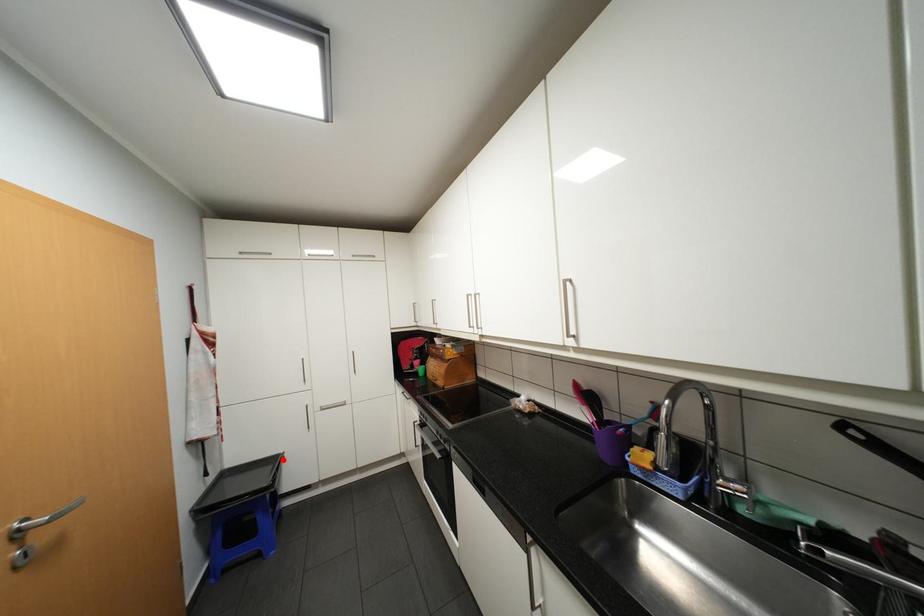
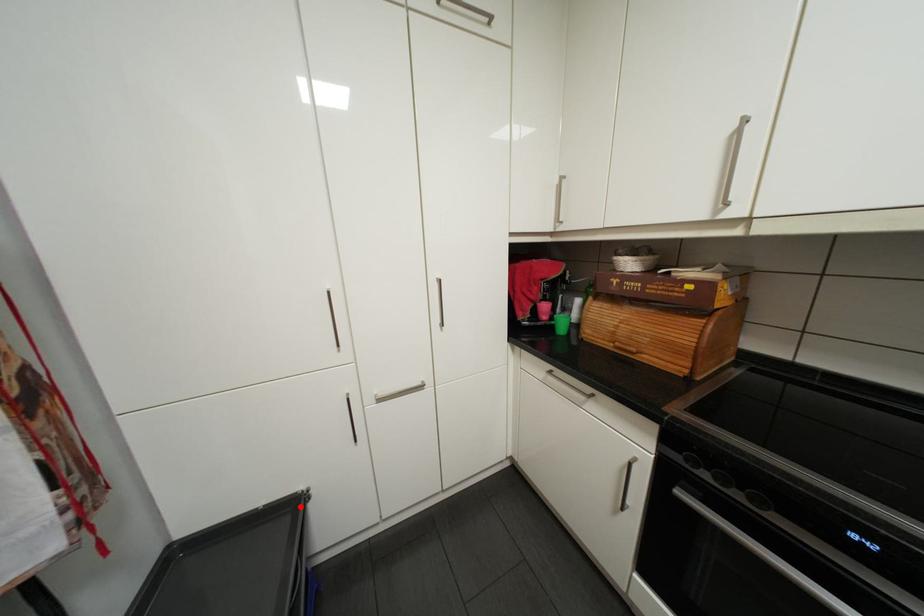
I am providing you with two images of the same scene from different viewpoints. A red point is marked on the first image and another point is marked on the second image. Does the point marked in image1 correspond to the same location as the one in image2?

Yes